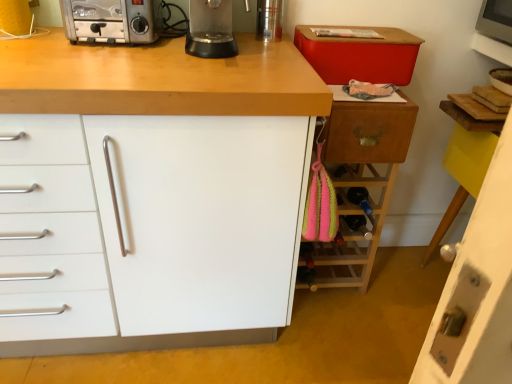
This screenshot has width=512, height=384. Identify the location of free space in front of wooden wine rack at right, the 2th cabinetry positioned from the right. (345, 314).